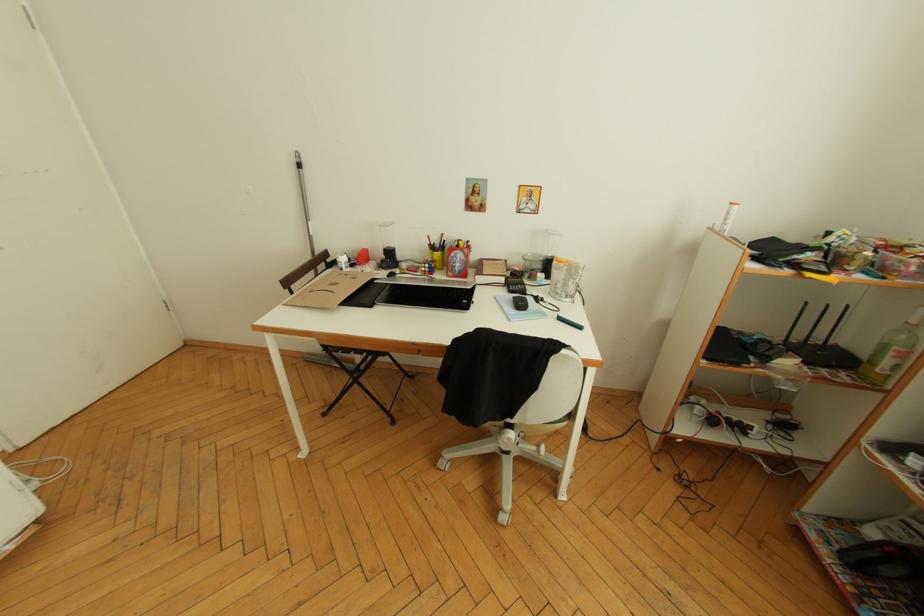
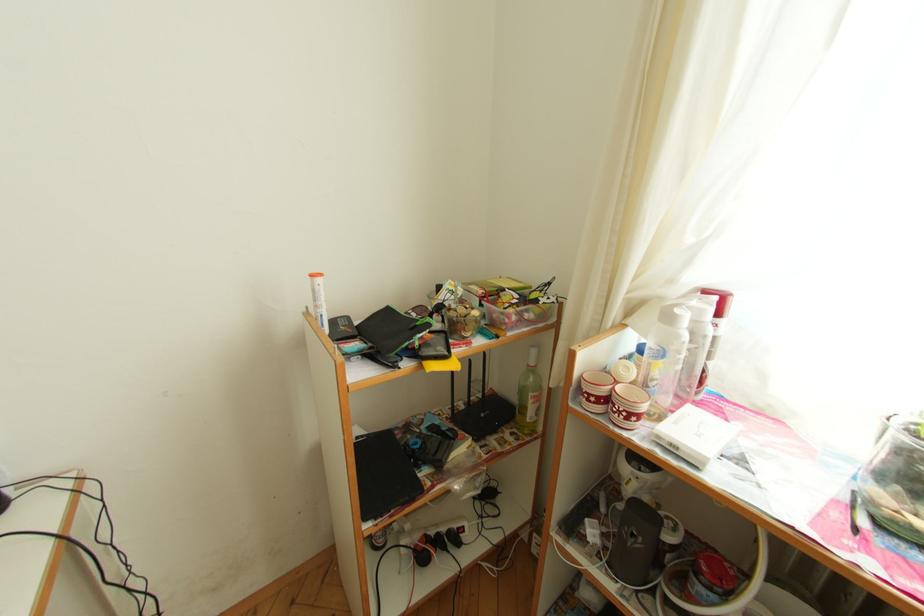
Question: The images are taken continuously from a first-person perspective. In which direction is your viewpoint rotating?

Choices:
 (A) Left
 (B) Right
 (C) Up
 (D) Down

Answer: (B)